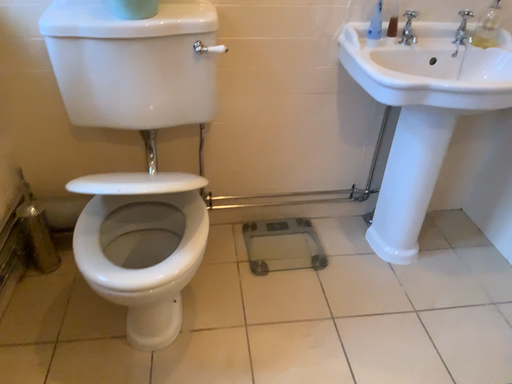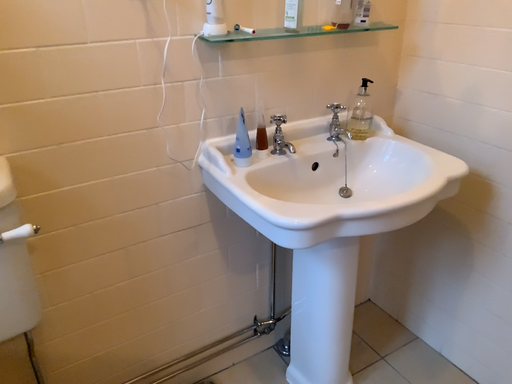
Question: Which way did the camera rotate in the video?

Choices:
 (A) rotated right
 (B) rotated left

Answer: (A)